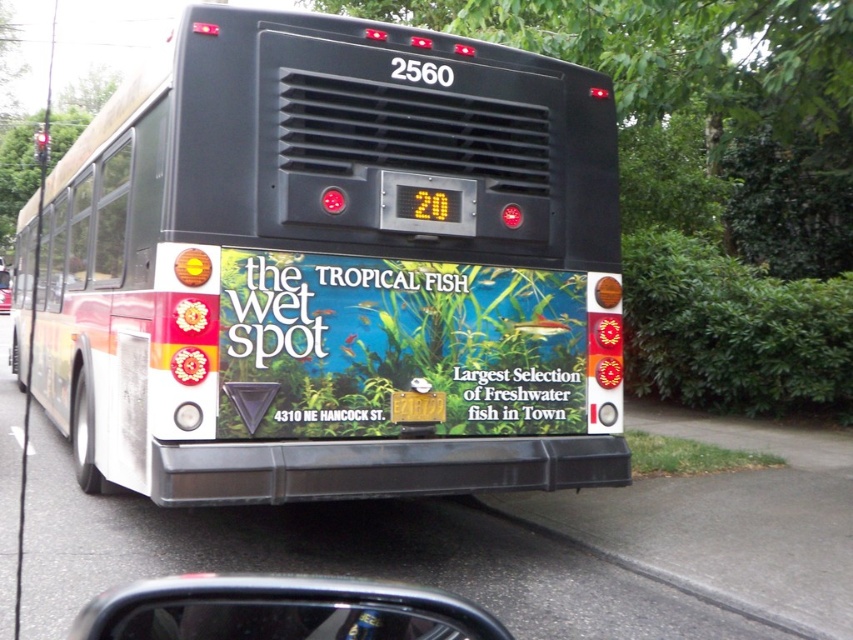
You are a delivery driver who needs to park your van on the street next to the gray concrete curb at lower right. However, there is a matte plastic signboard at center in the way. Can you drive around it to park your van?

The matte plastic signboard at center is positioned over the gray concrete curb at lower right, meaning the signboard is blocking access to the curb. You cannot drive around it and park your van there.